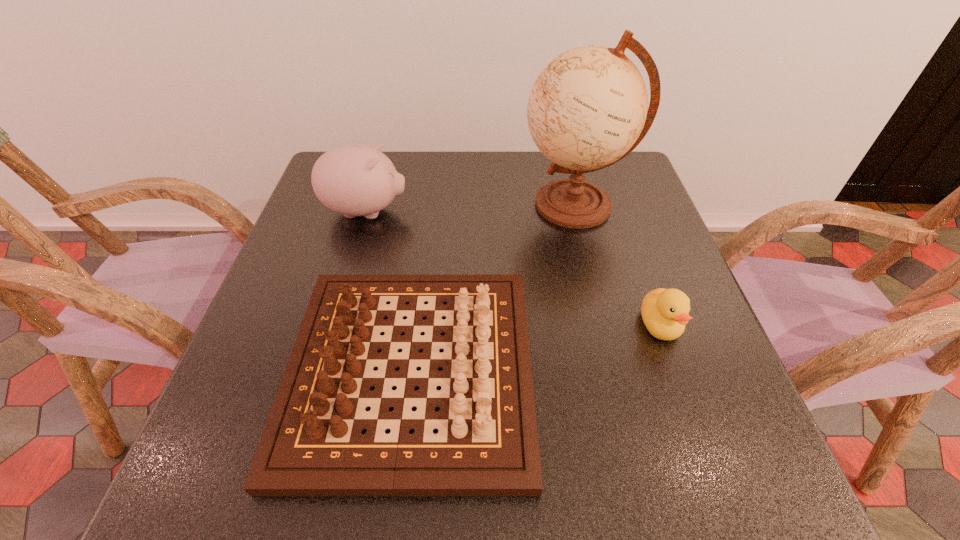
This screenshot has height=540, width=960. What are the coordinates of `empty space between the globe and the second tallest object` in the screenshot? It's located at (470, 208).

Locate an element on the screen. This screenshot has width=960, height=540. empty location between the duckling and the piggy bank is located at coordinates (513, 268).

Locate an element on the screen. This screenshot has width=960, height=540. empty location between the tallest object and the third shortest object is located at coordinates (470, 208).

The width and height of the screenshot is (960, 540). I want to click on free space between the duckling and the gameboard, so click(x=536, y=348).

Find the location of `object that ranks as the second closest to the tallest object`. object that ranks as the second closest to the tallest object is located at coordinates (664, 312).

Locate which object ranks second in proximity to the piggy bank. Please provide its 2D coordinates. Your answer should be formatted as a tuple, i.e. [(x, y)], where the tuple contains the x and y coordinates of a point satisfying the conditions above.

[(588, 108)]